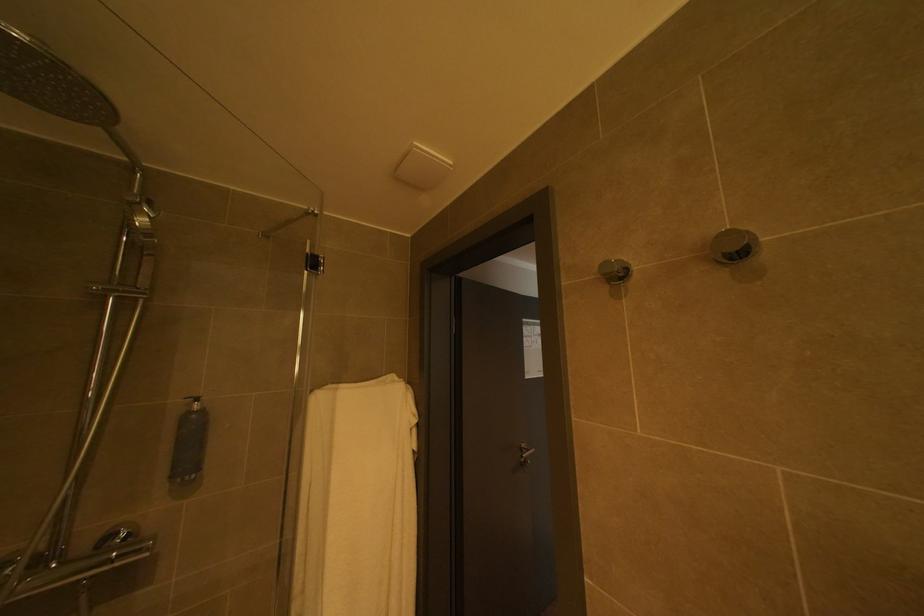
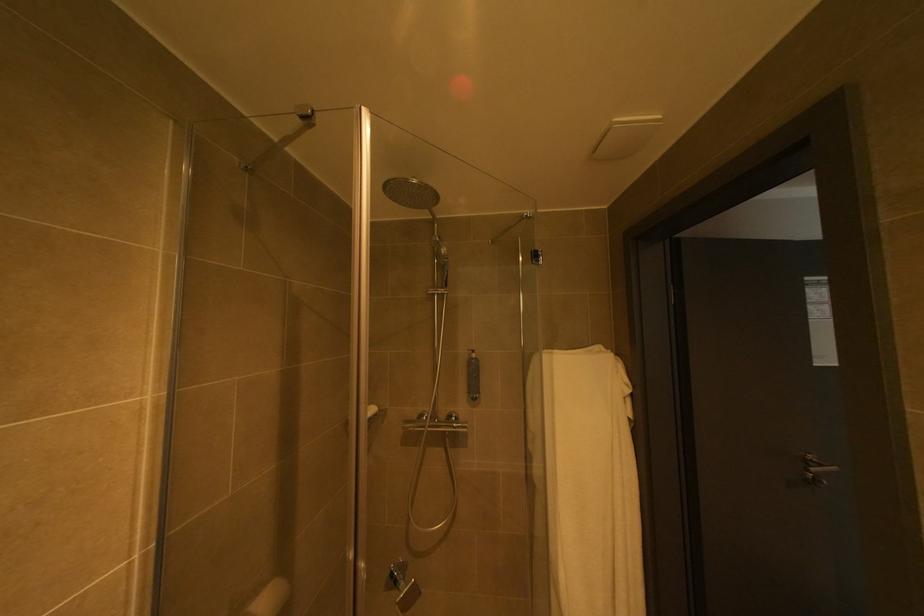
Question: The first image is from the beginning of the video and the second image is from the end. How did the camera likely rotate when shooting the video?

Choices:
 (A) Left
 (B) Right
 (C) Up
 (D) Down

Answer: (A)